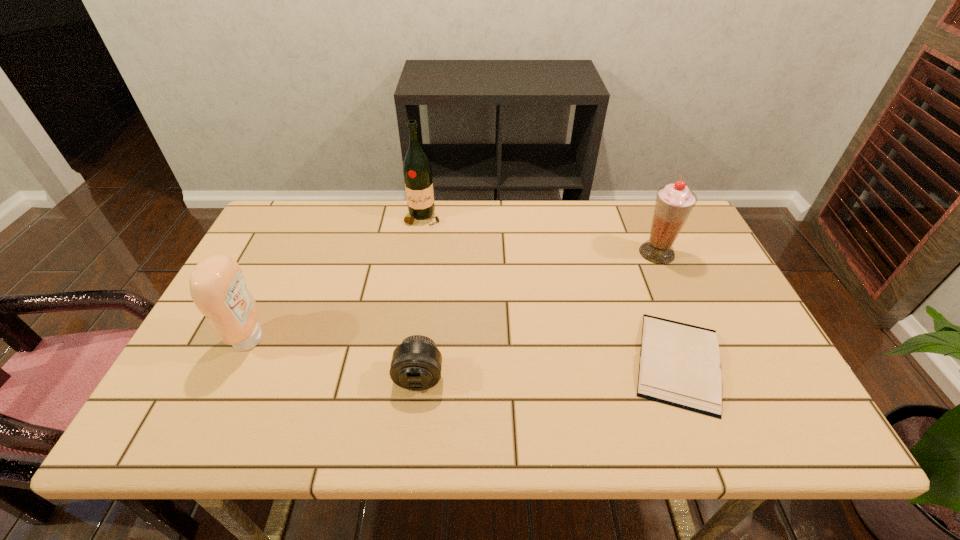
Identify the location of vacant region located on the right of the shortest object. This screenshot has width=960, height=540. (756, 362).

What are the coordinates of `wine bottle located at the far edge` in the screenshot? It's located at click(417, 172).

In order to click on smoothie at the far edge in this screenshot , I will do pos(674,202).

Identify the location of object situated at the near edge. (679, 364).

Where is `object that is at the left edge`? The height and width of the screenshot is (540, 960). object that is at the left edge is located at coordinates (218, 288).

Image resolution: width=960 pixels, height=540 pixels. Find the location of `smoothie at the right edge`. smoothie at the right edge is located at coordinates (674, 202).

Where is `hardback book that is at the right edge`? hardback book that is at the right edge is located at coordinates (679, 364).

The width and height of the screenshot is (960, 540). Identify the location of object that is at the far right corner. (674, 202).

At what (x,y) coordinates should I click in order to perform the action: click on object that is at the near right corner. Please return your answer as a coordinate pair (x, y). The width and height of the screenshot is (960, 540). Looking at the image, I should click on [679, 364].

This screenshot has height=540, width=960. What are the coordinates of `vacant space at the far edge of the desktop` in the screenshot? It's located at (335, 226).